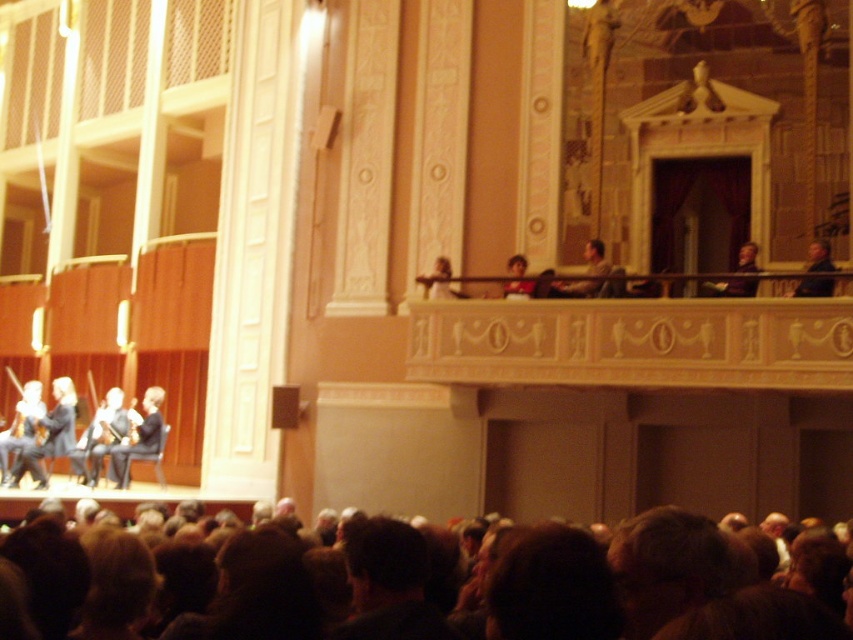
Question: Is light gray suit at stage left in front of light brown leather jacket at upper center?

Choices:
 (A) yes
 (B) no

Answer: (B)

Question: Which of the following is the closest to the observer?

Choices:
 (A) (788, 598)
 (B) (56, 426)
 (C) (583, 292)

Answer: (A)

Question: Which object is closer to the camera taking this photo?

Choices:
 (A) dark gray suit at stage left
 (B) light gray suit at stage left
 (C) light brown leather jacket at upper center

Answer: (C)

Question: Does light gray suit at stage left appear under dark gray suit at stage left?

Choices:
 (A) yes
 (B) no

Answer: (B)

Question: Is dark brown hair at lower center further to the viewer compared to light brown leather jacket at upper center?

Choices:
 (A) yes
 (B) no

Answer: (B)

Question: Based on their relative distances, which object is farther from the dark gray suit at stage left?

Choices:
 (A) dark brown hair at lower center
 (B) light gray suit at stage left
 (C) light brown leather jacket at upper center

Answer: (A)